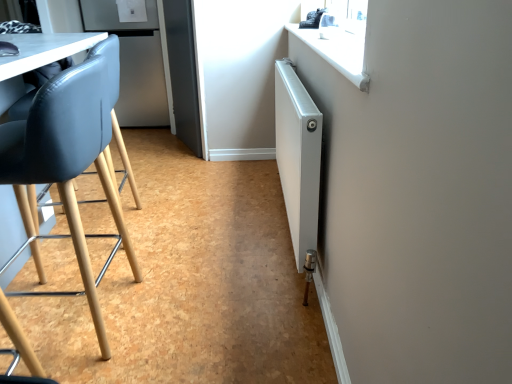
Identify the location of vacant area to the right of matte black chair at left. (191, 312).